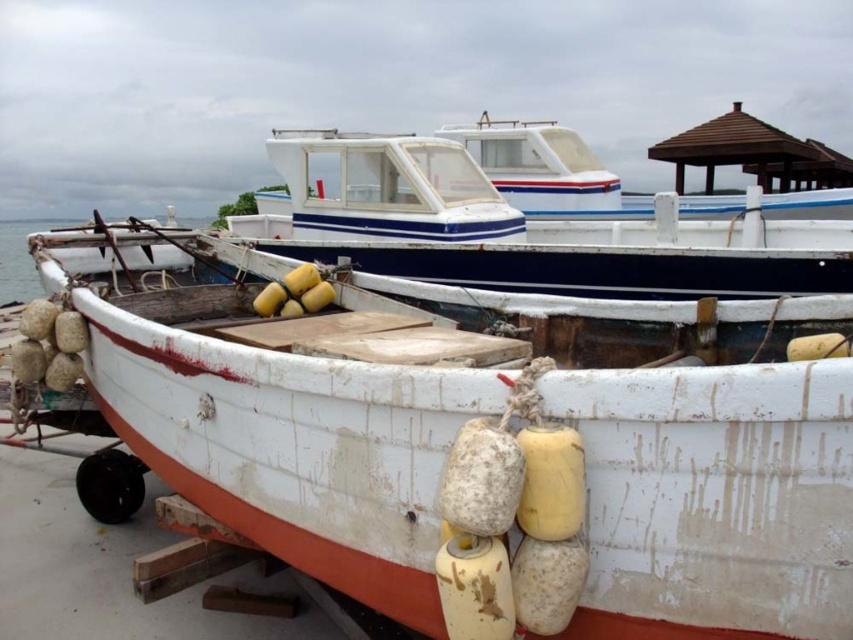
Who is positioned more to the right, white weathered wood boat at lower left or transparent water at boat front?

white weathered wood boat at lower left is more to the right.

Between white weathered wood boat at lower left and transparent water at boat front, which one has less height?

With less height is white weathered wood boat at lower left.

Locate an element on the screen. white weathered wood boat at lower left is located at coordinates (483, 428).

Does white matte boat at center appear over transparent water at boat front?

No.

Can you confirm if white matte boat at center is taller than transparent water at boat front?

No, white matte boat at center is not taller than transparent water at boat front.

Between point (747, 260) and point (27, 289), which one is positioned behind?

The point (27, 289) is behind.

Find the location of a particular element. white matte boat at center is located at coordinates (521, 228).

Who is higher up, white weathered wood boat at lower left or white matte boat at center?

Positioned higher is white matte boat at center.

Can you confirm if white weathered wood boat at lower left is positioned above white matte boat at center?

Actually, white weathered wood boat at lower left is below white matte boat at center.

Locate an element on the screen. The image size is (853, 640). white weathered wood boat at lower left is located at coordinates (483, 428).